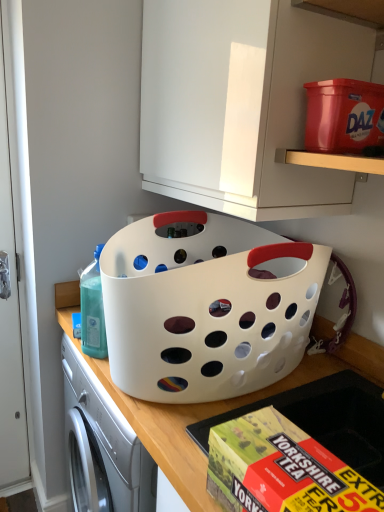
Question: Does yellow cardboard box at lower center have a lesser width compared to white glossy cabinet at upper center?

Choices:
 (A) yes
 (B) no

Answer: (A)

Question: Is yellow cardboard box at lower center not inside white glossy cabinet at upper center?

Choices:
 (A) no
 (B) yes

Answer: (B)

Question: Is white glossy cabinet at upper center completely or partially inside yellow cardboard box at lower center?

Choices:
 (A) yes
 (B) no

Answer: (B)

Question: Is the depth of yellow cardboard box at lower center less than that of white glossy cabinet at upper center?

Choices:
 (A) no
 (B) yes

Answer: (B)

Question: Considering the relative sizes of yellow cardboard box at lower center and white glossy cabinet at upper center in the image provided, is yellow cardboard box at lower center bigger than white glossy cabinet at upper center?

Choices:
 (A) no
 (B) yes

Answer: (A)

Question: Could you tell me if yellow cardboard box at lower center is facing white glossy cabinet at upper center?

Choices:
 (A) yes
 (B) no

Answer: (B)

Question: Is white plastic basket at center at the left side of white glossy cabinet at upper center?

Choices:
 (A) no
 (B) yes

Answer: (B)

Question: Can you confirm if white plastic basket at center is wider than white glossy cabinet at upper center?

Choices:
 (A) yes
 (B) no

Answer: (A)

Question: Is white plastic basket at center not close to white glossy cabinet at upper center?

Choices:
 (A) yes
 (B) no

Answer: (B)

Question: Is white plastic basket at center oriented towards white glossy cabinet at upper center?

Choices:
 (A) yes
 (B) no

Answer: (B)

Question: Is white plastic basket at center smaller than white glossy cabinet at upper center?

Choices:
 (A) no
 (B) yes

Answer: (A)

Question: Considering the relative sizes of white plastic basket at center and white glossy cabinet at upper center in the image provided, is white plastic basket at center taller than white glossy cabinet at upper center?

Choices:
 (A) yes
 (B) no

Answer: (A)

Question: Considering the relative sizes of yellow cardboard box at lower center and matte plastic storage box at upper right in the image provided, is yellow cardboard box at lower center wider than matte plastic storage box at upper right?

Choices:
 (A) no
 (B) yes

Answer: (A)